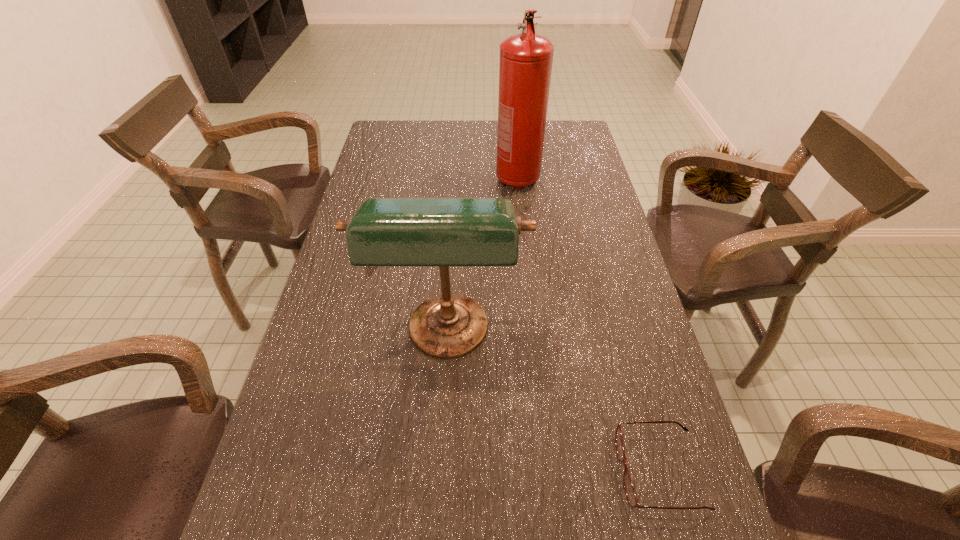
Identify the location of the tallest object. Image resolution: width=960 pixels, height=540 pixels. (525, 67).

I want to click on fire extinguisher, so click(525, 67).

This screenshot has height=540, width=960. I want to click on the second nearest object, so 443,232.

Where is `table lamp`? The image size is (960, 540). table lamp is located at coordinates click(443, 232).

Where is `spectacles`? The width and height of the screenshot is (960, 540). spectacles is located at coordinates (630, 492).

Identify the location of the nearest object. (630, 492).

You are a GUI agent. You are given a task and a screenshot of the screen. Output one action in this format:
    pyautogui.click(x=<x>, y=<y>)
    Task: Click on the free region located on the handle side the farthest object
    
    Given the screenshot: What is the action you would take?
    pyautogui.click(x=524, y=247)

Identify the location of free space located 0.280m above the green lampshade of the second tallest object. This screenshot has height=540, width=960. (437, 528).

Where is `free region located 0.360m on the lenses of the nearest object`? The width and height of the screenshot is (960, 540). free region located 0.360m on the lenses of the nearest object is located at coordinates (426, 471).

Where is `vacant space located 0.220m on the lenses of the nearest object`? vacant space located 0.220m on the lenses of the nearest object is located at coordinates (502, 471).